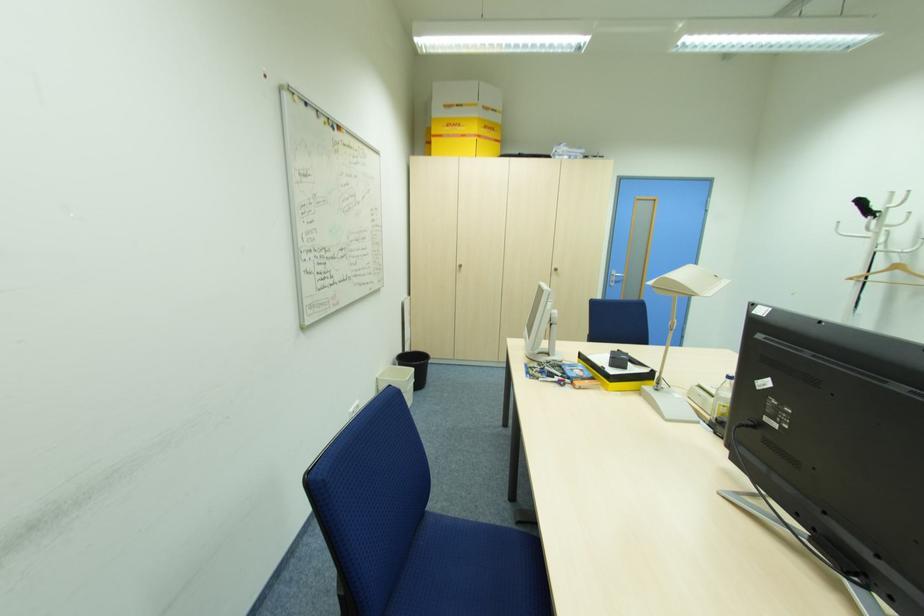
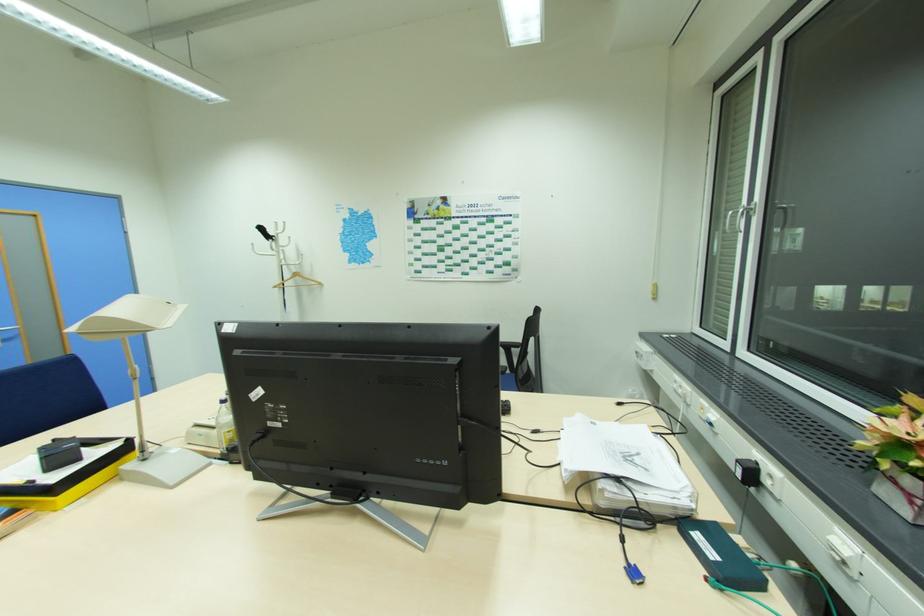
Locate, in the second image, the point that corresponds to pixel 621 280 in the first image.

(11, 337)